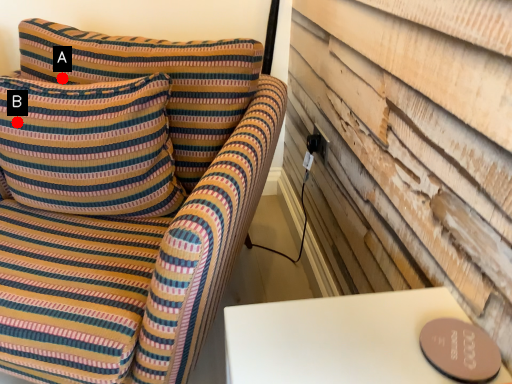
Question: Two points are circled on the image, labeled by A and B beside each circle. Which point is closer to the camera?

Choices:
 (A) A is closer
 (B) B is closer

Answer: (B)